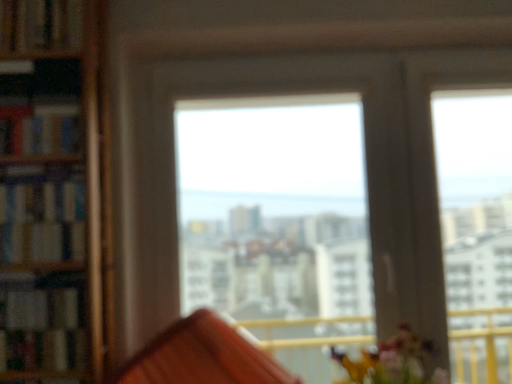
Question: From the image's perspective, is wooden bookshelf at left, the first book in the bottom-to-top sequence, on top of transparent glass window at center?

Choices:
 (A) yes
 (B) no

Answer: (B)

Question: Considering the relative positions of wooden bookshelf at left, which is the 4th book in top-to-bottom order, and transparent glass window at center in the image provided, is wooden bookshelf at left, which is the 4th book in top-to-bottom order, to the right of transparent glass window at center from the viewer's perspective?

Choices:
 (A) no
 (B) yes

Answer: (A)

Question: Are wooden bookshelf at left, the first book in the bottom-to-top sequence, and transparent glass window at center making contact?

Choices:
 (A) yes
 (B) no

Answer: (B)

Question: From a real-world perspective, is wooden bookshelf at left, the first book in the bottom-to-top sequence, positioned over transparent glass window at center based on gravity?

Choices:
 (A) yes
 (B) no

Answer: (B)

Question: Considering the relative sizes of wooden bookshelf at left, which is the 4th book in top-to-bottom order, and transparent glass window at center in the image provided, is wooden bookshelf at left, which is the 4th book in top-to-bottom order, shorter than transparent glass window at center?

Choices:
 (A) yes
 (B) no

Answer: (A)

Question: Would you say wooden bookshelf at left, the first book in the bottom-to-top sequence, contains transparent glass window at center?

Choices:
 (A) yes
 (B) no

Answer: (B)

Question: Is the position of hardcover book at left, positioned as the 3th book in top-to-bottom order, more distant than that of hardcover book at left, which is the second book from top to bottom?

Choices:
 (A) yes
 (B) no

Answer: (B)

Question: Considering the relative sizes of hardcover book at left, positioned as the 3th book in top-to-bottom order, and hardcover book at left, which is the 3th book from bottom to top, in the image provided, is hardcover book at left, positioned as the 3th book in top-to-bottom order, taller than hardcover book at left, which is the 3th book from bottom to top,?

Choices:
 (A) no
 (B) yes

Answer: (B)

Question: Is hardcover book at left, positioned as the 2th book in bottom-to-top order, turned away from hardcover book at left, which is the second book from top to bottom?

Choices:
 (A) no
 (B) yes

Answer: (A)

Question: Does hardcover book at left, positioned as the 2th book in bottom-to-top order, have a lesser height compared to hardcover book at left, which is the 3th book from bottom to top?

Choices:
 (A) yes
 (B) no

Answer: (B)

Question: From a real-world perspective, is hardcover book at left, positioned as the 3th book in top-to-bottom order, positioned over hardcover book at left, which is the second book from top to bottom, based on gravity?

Choices:
 (A) yes
 (B) no

Answer: (B)

Question: Is hardcover book at left, positioned as the 2th book in bottom-to-top order, not near hardcover book at left, which is the second book from top to bottom?

Choices:
 (A) no
 (B) yes

Answer: (A)

Question: Is hardcover book at upper left, the 1th book viewed from the top, to the left of wooden bookshelf at left, which is the 4th book in top-to-bottom order, from the viewer's perspective?

Choices:
 (A) yes
 (B) no

Answer: (A)